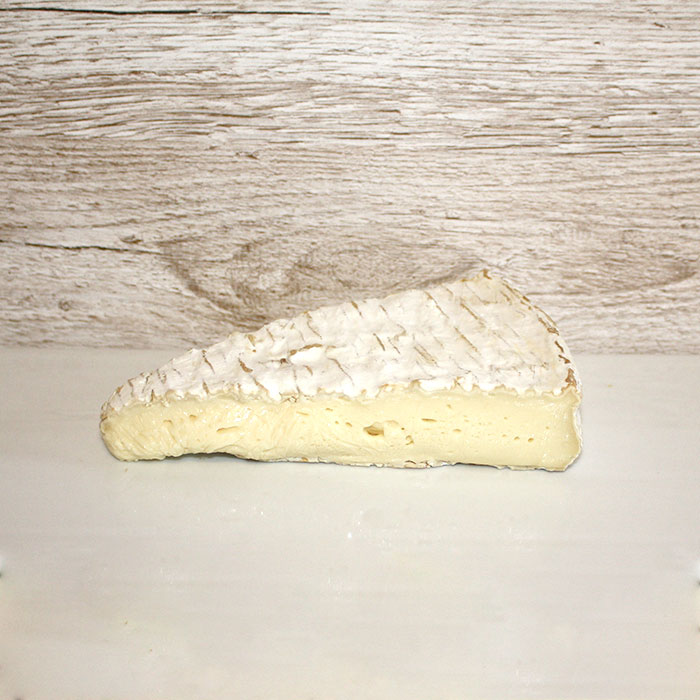
You are a GUI agent. You are given a task and a screenshot of the screen. Output one action in this format:
    pyautogui.click(x=<x>, y=<y>)
    Task: Click on the wood board
    
    Given the screenshot: What is the action you would take?
    pyautogui.click(x=332, y=222)